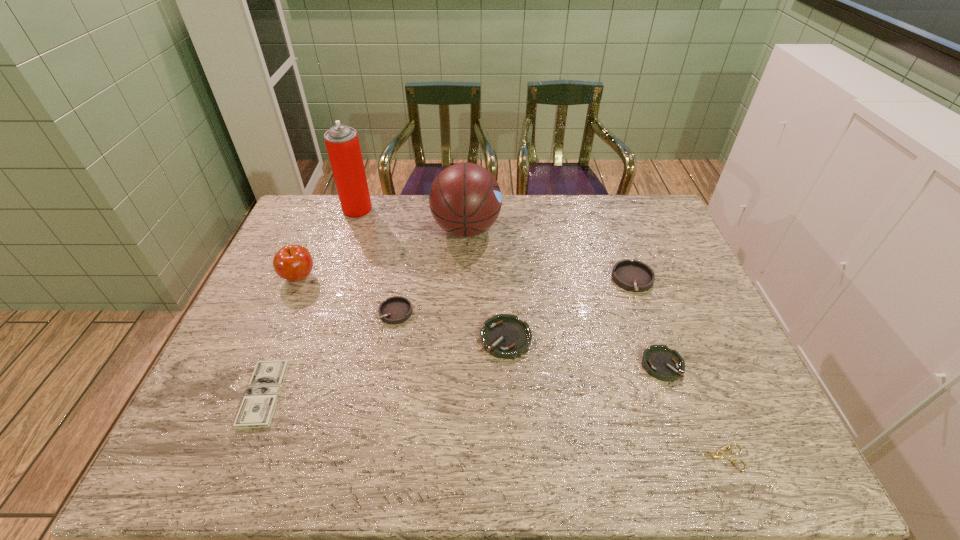
Locate an element on the screen. This screenshot has height=540, width=960. free point that satisfies the following two spatial constraints: 1. on the front side of the left gray ashtray; 2. on the left side of the left green ashtray is located at coordinates (391, 338).

This screenshot has width=960, height=540. Identify the location of vacant area in the image that satisfies the following two spatial constraints: 1. on the front side of the third tallest object; 2. on the left side of the dollar. (250, 394).

Identify the location of free space that satisfies the following two spatial constraints: 1. on the back side of the dollar; 2. on the left side of the red aerosol can. Image resolution: width=960 pixels, height=540 pixels. (337, 210).